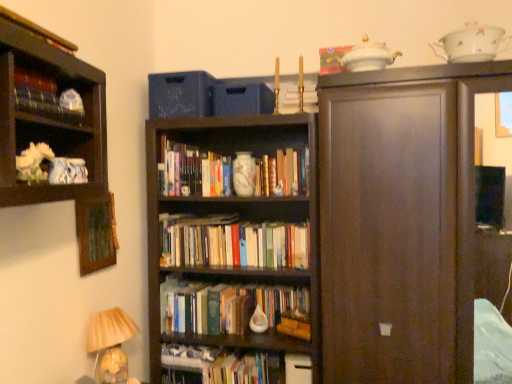
Question: Should I look upward or downward to see matte black book at upper left, the fourth book when ordered from right to left?

Choices:
 (A) down
 (B) up

Answer: (B)

Question: Is dark wood cupboard at right not near wooden picture frame at upper left?

Choices:
 (A) no
 (B) yes

Answer: (B)

Question: Does dark wood cupboard at right have a greater width compared to wooden picture frame at upper left?

Choices:
 (A) yes
 (B) no

Answer: (A)

Question: Does dark wood cupboard at right lie in front of wooden picture frame at upper left?

Choices:
 (A) no
 (B) yes

Answer: (B)

Question: Is wooden picture frame at upper left at the back of dark wood cupboard at right?

Choices:
 (A) yes
 (B) no

Answer: (B)

Question: Is dark wood cupboard at right bigger than wooden picture frame at upper left?

Choices:
 (A) yes
 (B) no

Answer: (A)

Question: Can you confirm if dark wood cupboard at right is smaller than wooden picture frame at upper left?

Choices:
 (A) yes
 (B) no

Answer: (B)

Question: Is matte black book at upper left, placed as the 1th book when sorted from left to right, oriented away from dark wood cupboard at right?

Choices:
 (A) no
 (B) yes

Answer: (A)

Question: Is matte black book at upper left, positioned as the second book in top-to-bottom order, smaller than dark wood cupboard at right?

Choices:
 (A) yes
 (B) no

Answer: (A)

Question: Is matte black book at upper left, positioned as the second book in top-to-bottom order, positioned before dark wood cupboard at right?

Choices:
 (A) yes
 (B) no

Answer: (A)

Question: From a real-world perspective, is matte black book at upper left, positioned as the second book in top-to-bottom order, below dark wood cupboard at right?

Choices:
 (A) yes
 (B) no

Answer: (B)

Question: Is matte black book at upper left, the 1th book from the front, aimed at dark wood cupboard at right?

Choices:
 (A) no
 (B) yes

Answer: (A)

Question: Is matte black book at upper left, positioned as the second book in top-to-bottom order, positioned far away from dark wood cupboard at right?

Choices:
 (A) no
 (B) yes

Answer: (B)

Question: Does hardcover books at center, acting as the fourth book starting from the front, contain translucent glass lampshade at lower left?

Choices:
 (A) yes
 (B) no

Answer: (B)